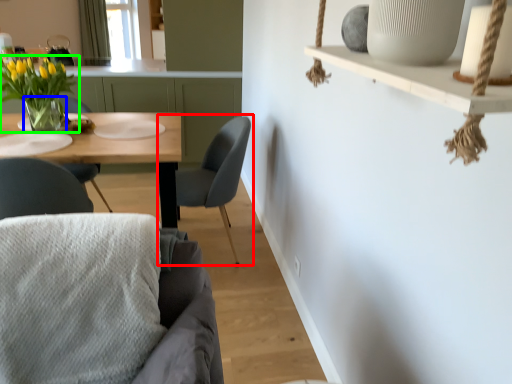
Question: Which is farther away from chair (highlighted by a red box)? vase (highlighted by a blue box) or houseplant (highlighted by a green box)?

Choices:
 (A) vase
 (B) houseplant

Answer: (B)